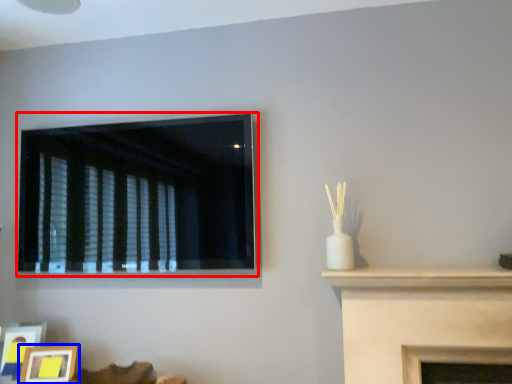
Question: Which point is closer to the camera, window (highlighted by a red box) or picture frame (highlighted by a blue box)?

Choices:
 (A) window
 (B) picture frame

Answer: (A)